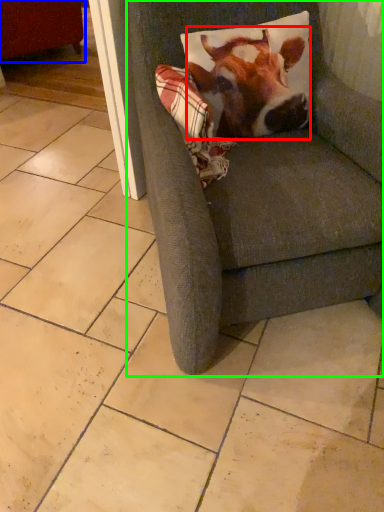
Question: Estimate the real-world distances between objects in this image. Which object is closer to cattle (highlighted by a red box), swivel chair (highlighted by a blue box) or chair (highlighted by a green box)?

Choices:
 (A) swivel chair
 (B) chair

Answer: (B)